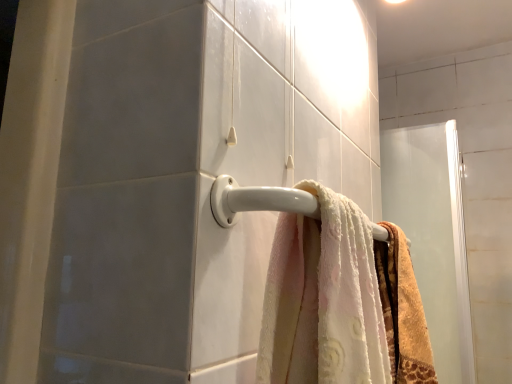
Question: Should I look upward or downward to see beige textured towel at center?

Choices:
 (A) up
 (B) down

Answer: (B)